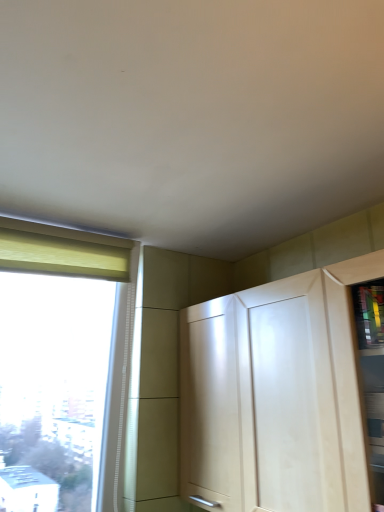
Locate an element on the screen. The height and width of the screenshot is (512, 384). matte wood cabinet at right is located at coordinates (281, 393).

Describe the element at coordinates (281, 393) in the screenshot. I see `matte wood cabinet at right` at that location.

Locate an element on the screen. matte wood cabinet at right is located at coordinates (281, 393).